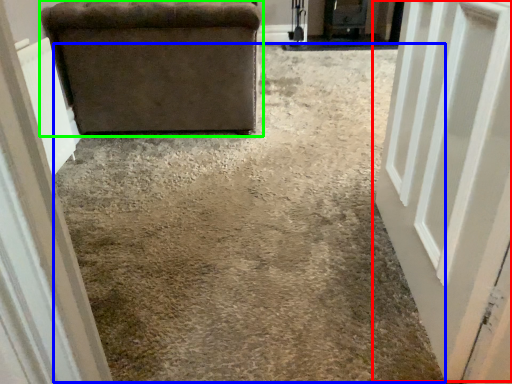
Question: Considering the real-world distances, which object is farthest from door (highlighted by a red box)? concrete (highlighted by a blue box) or furniture (highlighted by a green box)?

Choices:
 (A) concrete
 (B) furniture

Answer: (B)